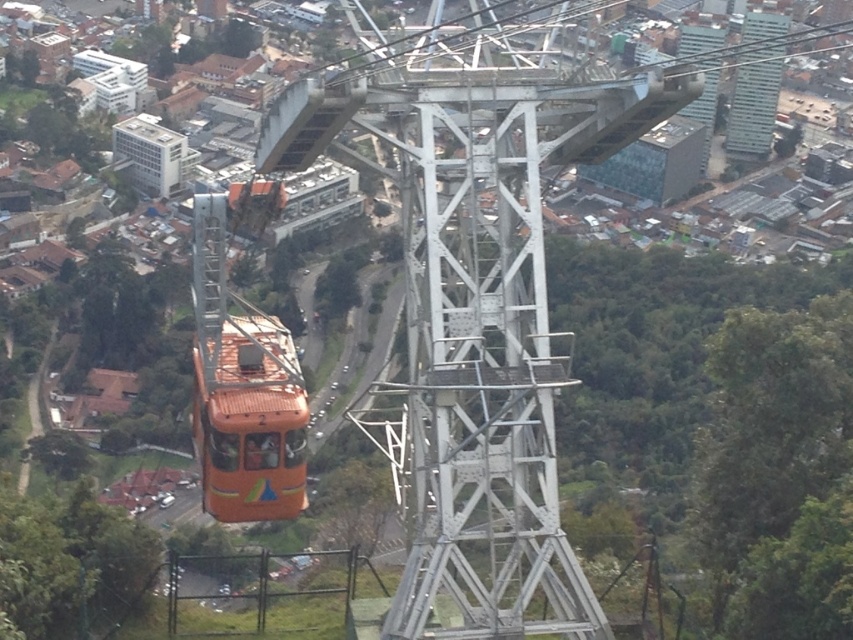
You are a tourist standing at the base of the metallic silver tower at upper right and want to take a photo of the white matte building at upper left. Will the tower block your view of the building?

The metallic silver tower at upper right is behind the white matte building at upper left, so it will not block your view of the building.

In the scene shown: You are a passenger in the orange cable car marked 2. You notice two points marked on the window. The first point is at coordinates point (764, 124) and the second is at point (170, 145). From your perspective inside the cable car, which point appears closer to you?

Point (170, 145) appears closer to you because it is in front of point (764, 124).

You are a passenger in the orange cable car marked 2. You look upwards and see both the metallic glass skyscraper at upper right and the metallic silver tower at upper right. Which one is positioned higher in the sky?

The metallic glass skyscraper at upper right is positioned higher in the sky than the metallic silver tower at upper right.